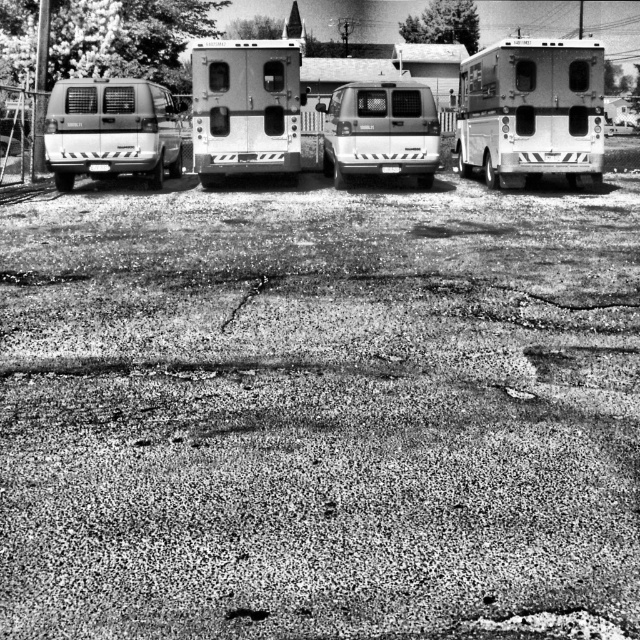
You are a pedestrian standing at the edge of the parking lot. You see the metallic silver camper at center and the matte white van at left. Which vehicle is closer to you?

The metallic silver camper at center is closer to you because it is in front of the matte white van at left.

From the picture: You are a delivery driver who needs to park your truck in the parking lot shown in the image. There are two points marked as point [83,83] and point [397,131]. Which point should you choose to park your truck so that it is closer to the entrance of the parking lot?

Point [83,83] is in front of point [397,131], so parking at point [83,83] would place your truck closer to the entrance of the parking lot.

You are standing in the parking lot and need to locate the metallic silver camper at center. According to the coordinates provided, where exactly is it positioned?

The metallic silver camper at center is located at point [244,108].